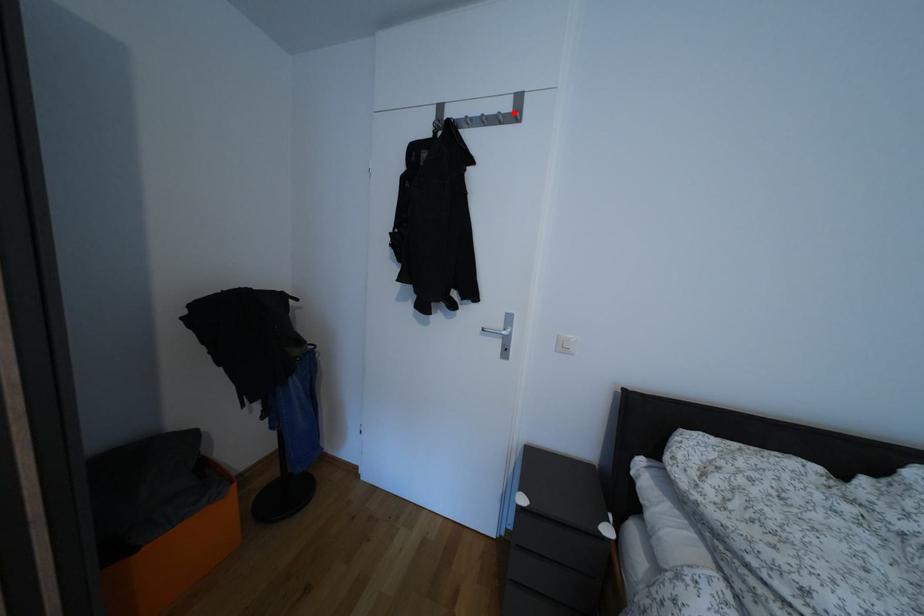
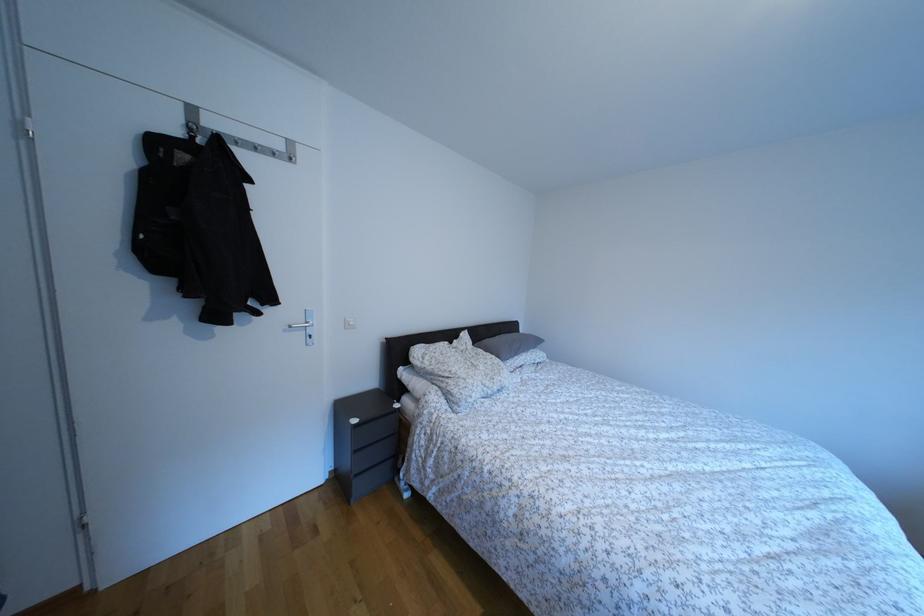
Where in the second image is the point corresponding to the highlighted location from the first image?

(286, 152)